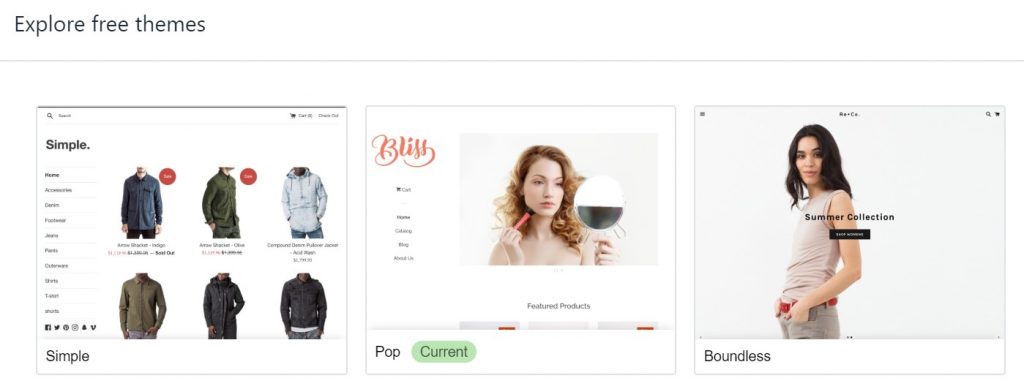
I want to click on mirror, so click(602, 207).